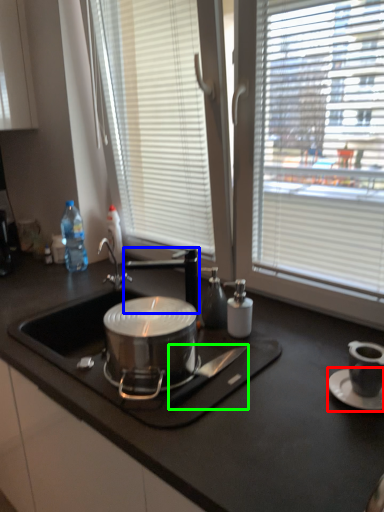
Question: Which is farther away from saucer (highlighted by a red box)? tap (highlighted by a blue box) or knife (highlighted by a green box)?

Choices:
 (A) tap
 (B) knife

Answer: (A)